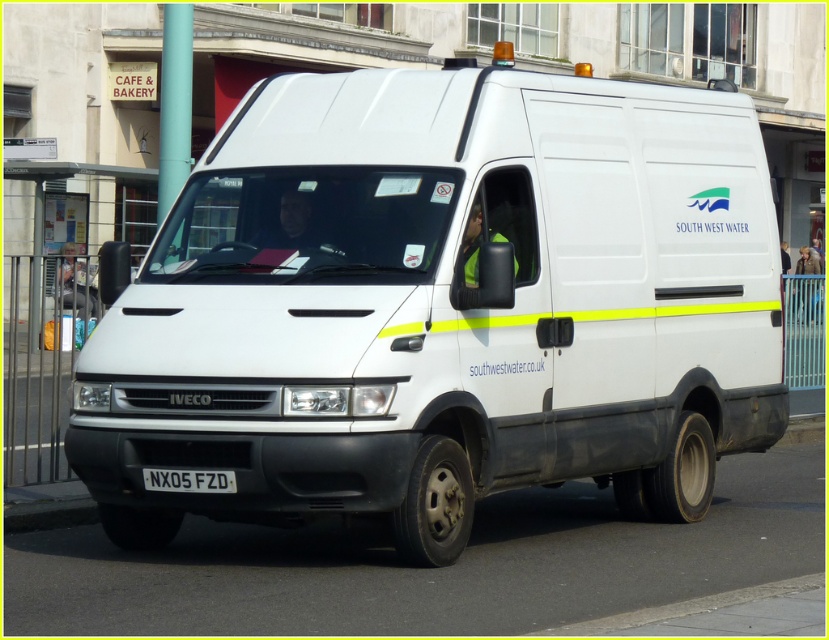
Is white matte van at center shorter than white plastic license plate at center?

Incorrect, white matte van at center's height does not fall short of white plastic license plate at center's.

Can you confirm if white matte van at center is wider than white plastic license plate at center?

Correct, the width of white matte van at center exceeds that of white plastic license plate at center.

Who is more forward, (628, 401) or (178, 480)?

Positioned in front is point (178, 480).

At what (x,y) coordinates should I click in order to perform the action: click on white matte van at center. Please return your answer as a coordinate pair (x, y). This screenshot has width=829, height=640. Looking at the image, I should click on (440, 307).